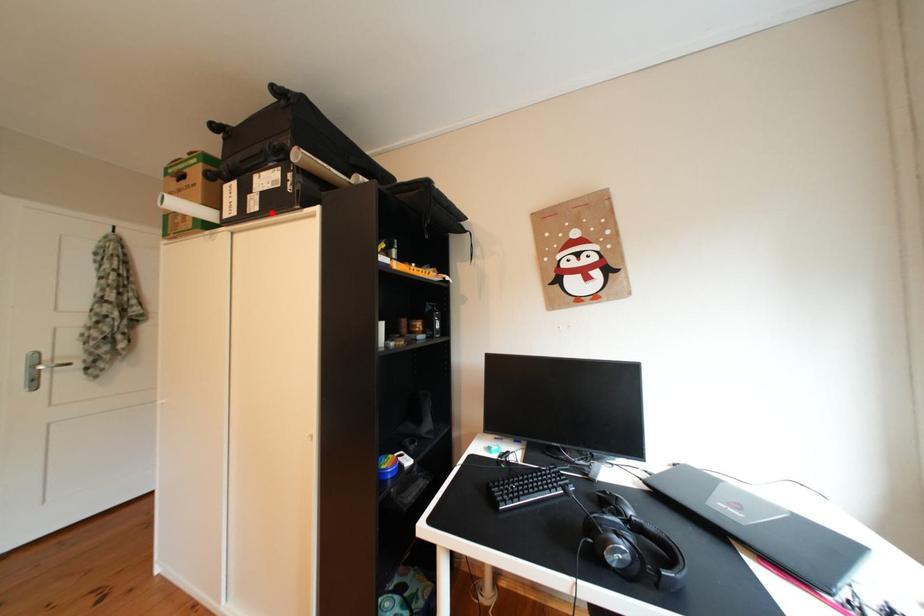
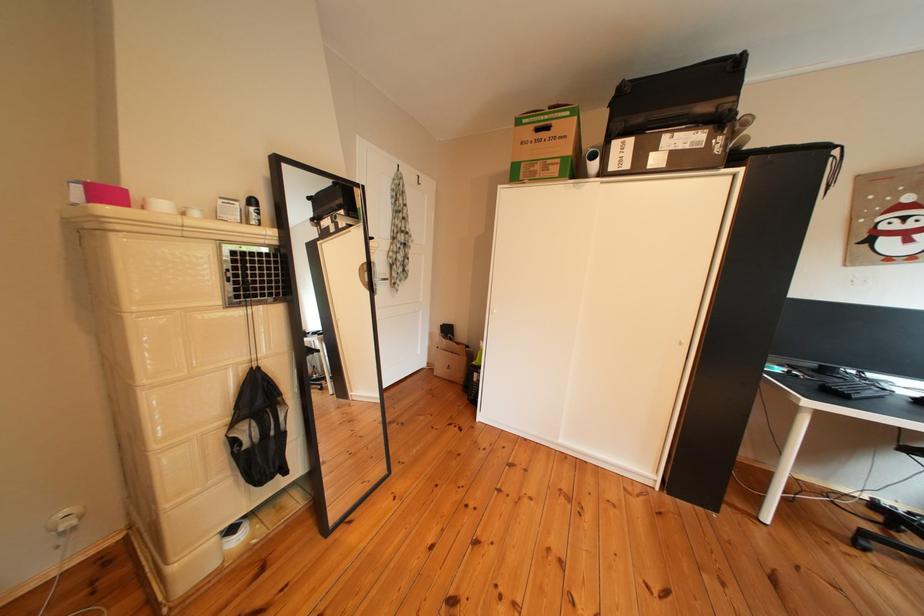
Where in the second image is the point corresponding to the highlighted location from the first image?

(676, 169)